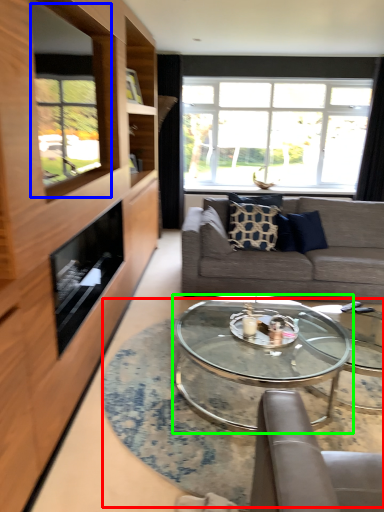
Question: Estimate the real-world distances between objects in this image. Which object is closer to table (highlighted by a red box), window screen (highlighted by a blue box) or coffee table (highlighted by a green box)?

Choices:
 (A) window screen
 (B) coffee table

Answer: (B)